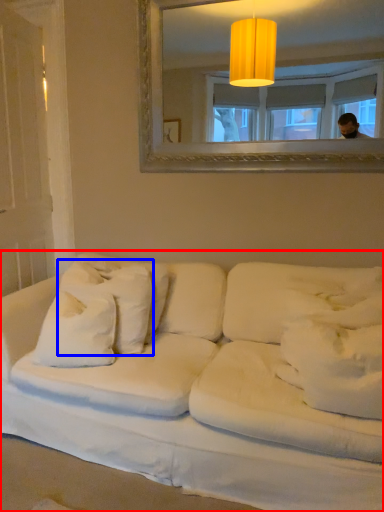
Question: Among these objects, which one is nearest to the camera, studio couch (highlighted by a red box) or pillow (highlighted by a blue box)?

Choices:
 (A) studio couch
 (B) pillow

Answer: (A)